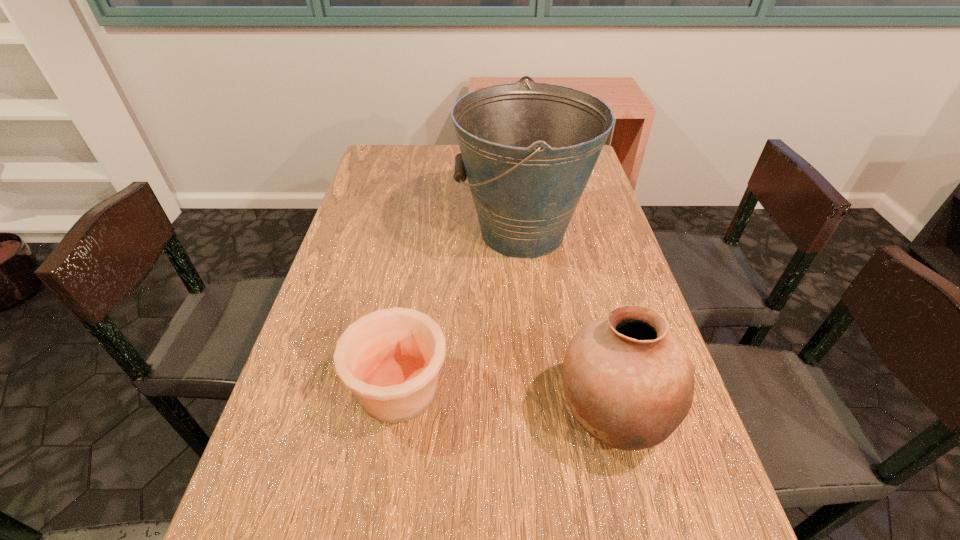
Locate an element on the screen. This screenshot has width=960, height=540. free spot between the shorter pottery and the tallest object is located at coordinates (461, 310).

I want to click on free area in between the farthest object and the taller pottery, so click(568, 322).

You are a GUI agent. You are given a task and a screenshot of the screen. Output one action in this format:
    pyautogui.click(x=<x>, y=<y>)
    Task: Click on the free space that is in between the shortest object and the tallest object
    The width and height of the screenshot is (960, 540).
    Given the screenshot: What is the action you would take?
    pos(461,310)

The height and width of the screenshot is (540, 960). Find the location of `unoccupied position between the shorter pottery and the farthest object`. unoccupied position between the shorter pottery and the farthest object is located at coordinates (461, 310).

This screenshot has height=540, width=960. Identify the location of object that stands as the closest to the taller pottery. pyautogui.click(x=390, y=358).

Image resolution: width=960 pixels, height=540 pixels. Find the location of `the closest object to the left pottery`. the closest object to the left pottery is located at coordinates click(x=629, y=382).

Find the location of a particular element. The height and width of the screenshot is (540, 960). vacant point that satisfies the following two spatial constraints: 1. with the handle on opposite sides of the tallest object; 2. on the back side of the second tallest object is located at coordinates (543, 413).

Where is `free space that satisfies the following two spatial constraints: 1. with the handle on opposite sides of the bucket; 2. on the front side of the shorter pottery`? This screenshot has height=540, width=960. free space that satisfies the following two spatial constraints: 1. with the handle on opposite sides of the bucket; 2. on the front side of the shorter pottery is located at coordinates (540, 389).

In order to click on blank area in the image that satisfies the following two spatial constraints: 1. with the handle on opposite sides of the tallest object; 2. on the right side of the right pottery in this screenshot , I will do `click(543, 413)`.

You are a GUI agent. You are given a task and a screenshot of the screen. Output one action in this format:
    pyautogui.click(x=<x>, y=<y>)
    Task: Click on the free space that satisfies the following two spatial constraints: 1. with the handle on opposite sides of the tallest object; 2. on the front side of the shorter pottery
    The width and height of the screenshot is (960, 540).
    Given the screenshot: What is the action you would take?
    pyautogui.click(x=540, y=389)